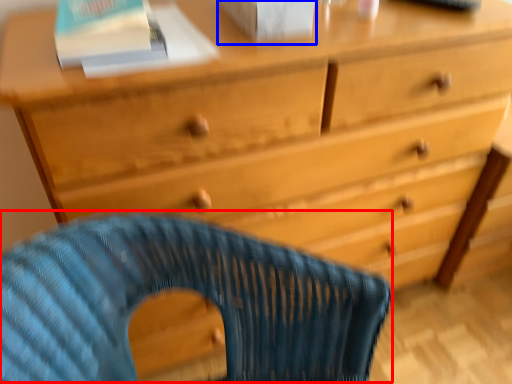
Question: Which object is closer to the camera taking this photo, rocking chair (highlighted by a red box) or paperback book (highlighted by a blue box)?

Choices:
 (A) rocking chair
 (B) paperback book

Answer: (A)